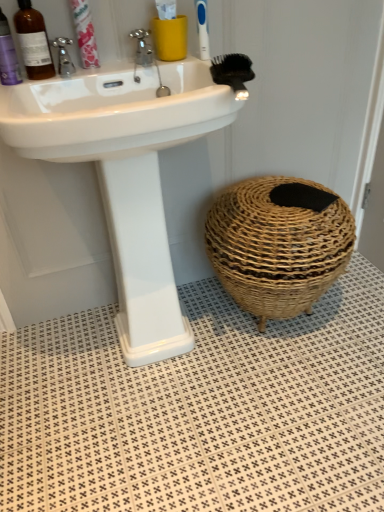
Locate an element on the screen. vacant location below white glossy sink at upper center (from a real-world perspective) is located at coordinates click(x=159, y=360).